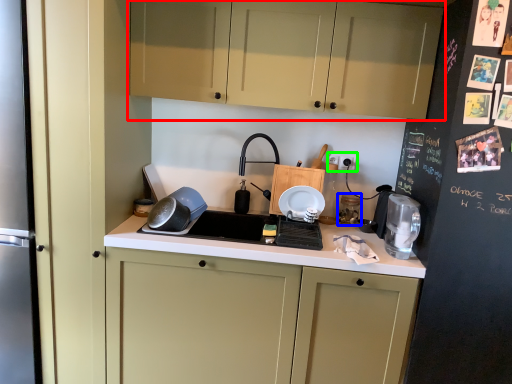
Question: Which object is positioned farthest from cabinetry (highlighted by a red box)? Select from appliance (highlighted by a blue box) and electric outlet (highlighted by a green box).

Choices:
 (A) appliance
 (B) electric outlet

Answer: (A)